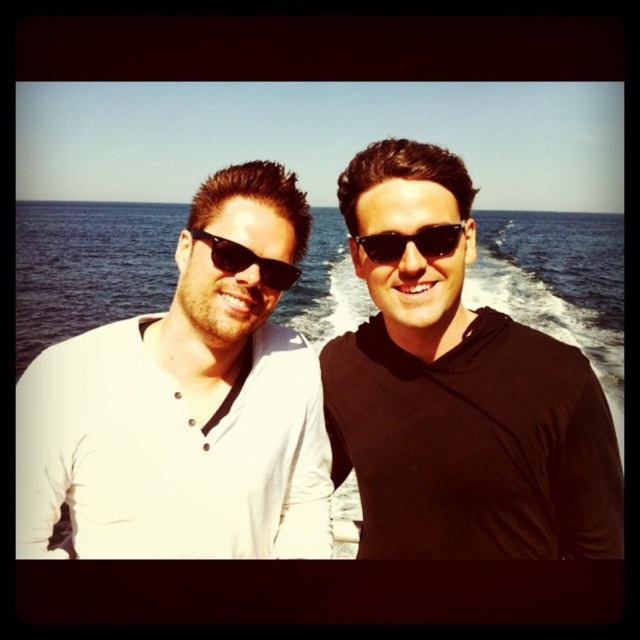
Based on the photo, you are a photographer trying to capture a group photo of the two people in the scene. You need to ensure that both the white matte shirt at center and the black plastic sunglasses at center are in focus. Given that your camera has a depth of field that can cover up to 3 meters, will you be able to capture both objects clearly in the same shot?

The white matte shirt at center and black plastic sunglasses at center are 3.15 meters apart. Since the camera can only cover up to 3 meters, the distance between them exceeds the depth of field capacity. Therefore, both objects cannot be in focus simultaneously in the same shot.

You are a photographer trying to capture a clear shot of both the white matte shirt at center and the black plastic sunglasses at center. Since both are at the center, which object should you focus on first to ensure proper framing?

The white matte shirt at center is taller than the black plastic sunglasses at center, so you should focus on the white matte shirt at center first to ensure proper framing.